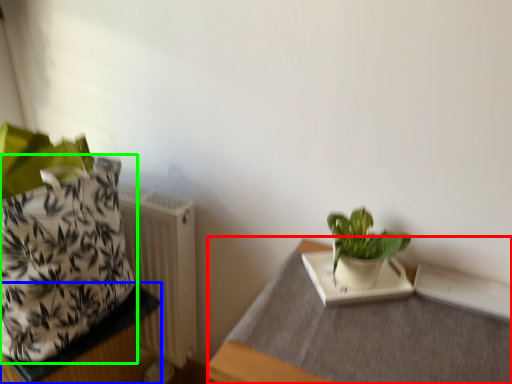
Question: Which is nearer to the table (highlighted by a red box)? table (highlighted by a blue box) or flowerpot (highlighted by a green box).

Choices:
 (A) table
 (B) flowerpot

Answer: (B)